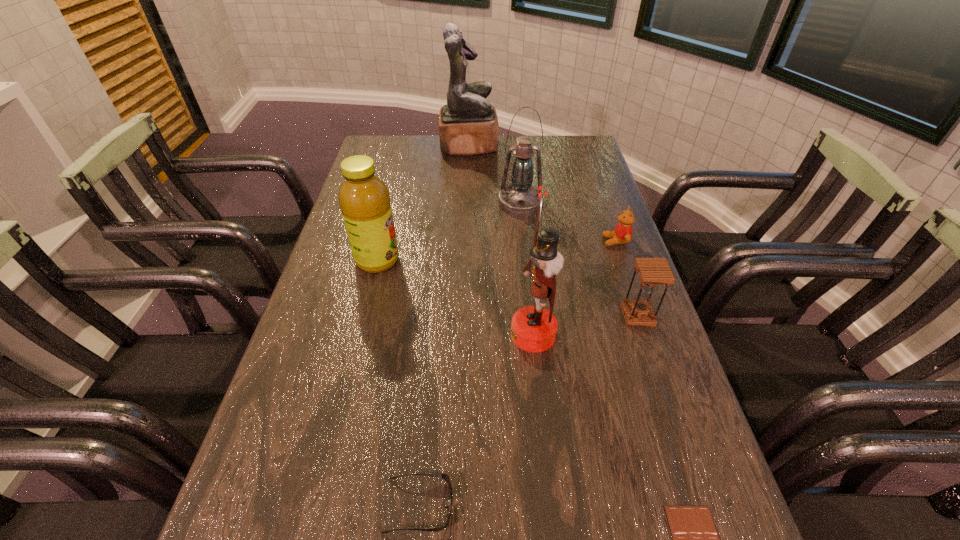
You are a GUI agent. You are given a task and a screenshot of the screen. Output one action in this format:
    pyautogui.click(x=<x>, y=<y>)
    Task: Click on the hourglass that is at the right edge
    
    Given the screenshot: What is the action you would take?
    pyautogui.click(x=652, y=272)

I want to click on teddy bear at the right edge, so click(622, 234).

In the image, there is a desktop. Find the location of `vacant space at the far edge`. vacant space at the far edge is located at coordinates (514, 158).

Where is `vacant space at the left edge`? Image resolution: width=960 pixels, height=540 pixels. vacant space at the left edge is located at coordinates (367, 291).

The width and height of the screenshot is (960, 540). In the image, there is a desktop. In order to click on free space at the right edge in this screenshot , I will do `click(658, 378)`.

The width and height of the screenshot is (960, 540). In order to click on vacant region at the far left corner in this screenshot , I will do `click(381, 138)`.

At what (x,y) coordinates should I click in order to perform the action: click on vacant area at the far right corner. Please return your answer as a coordinate pair (x, y). This screenshot has height=540, width=960. Looking at the image, I should click on (584, 136).

This screenshot has height=540, width=960. Identify the location of empty location between the nutcracker and the fruit juice. (455, 298).

The image size is (960, 540). I want to click on free space between the leftmost object and the third shortest object, so click(x=496, y=251).

Where is `vacant space in between the oil lamp and the sculpture`? vacant space in between the oil lamp and the sculpture is located at coordinates (494, 174).